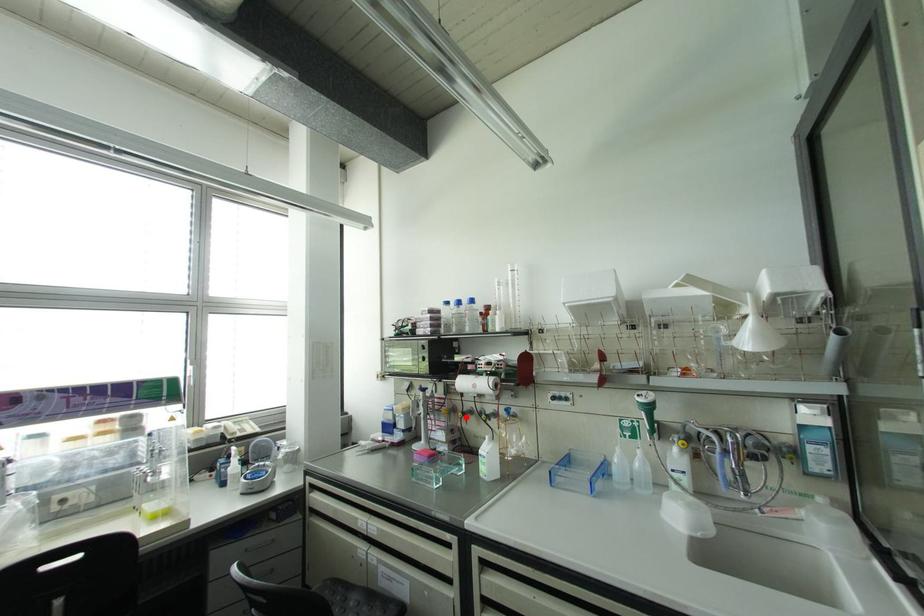
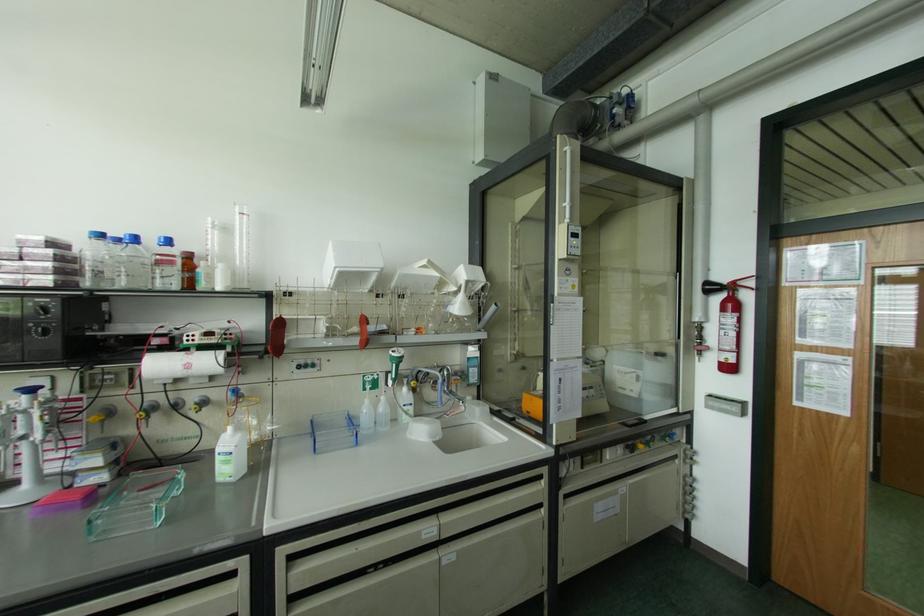
Question: I am providing you with two images of the same scene from different viewpoints. Given a red point in image1, look at the same physical point in image2. Is it:

Choices:
 (A) Closer to the viewpoint
 (B) Farther from the viewpoint

Answer: (A)